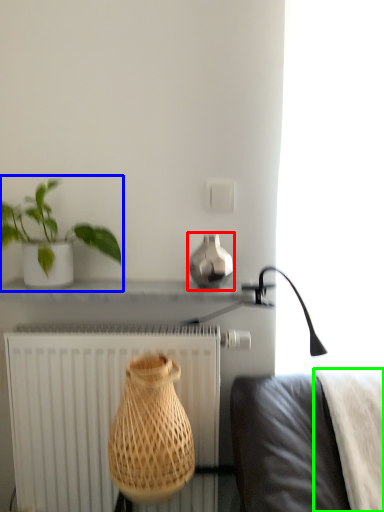
Question: Considering the real-world distances, which object is farthest from vase (highlighted by a red box)? houseplant (highlighted by a blue box) or blanket (highlighted by a green box)?

Choices:
 (A) houseplant
 (B) blanket

Answer: (B)